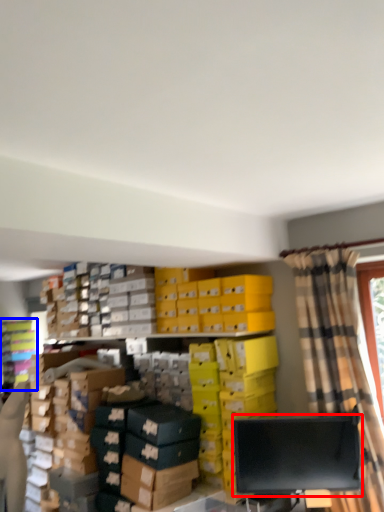
Question: Among these objects, which one is nearest to the camera, computer monitor (highlighted by a red box) or shelf (highlighted by a blue box)?

Choices:
 (A) computer monitor
 (B) shelf

Answer: (A)